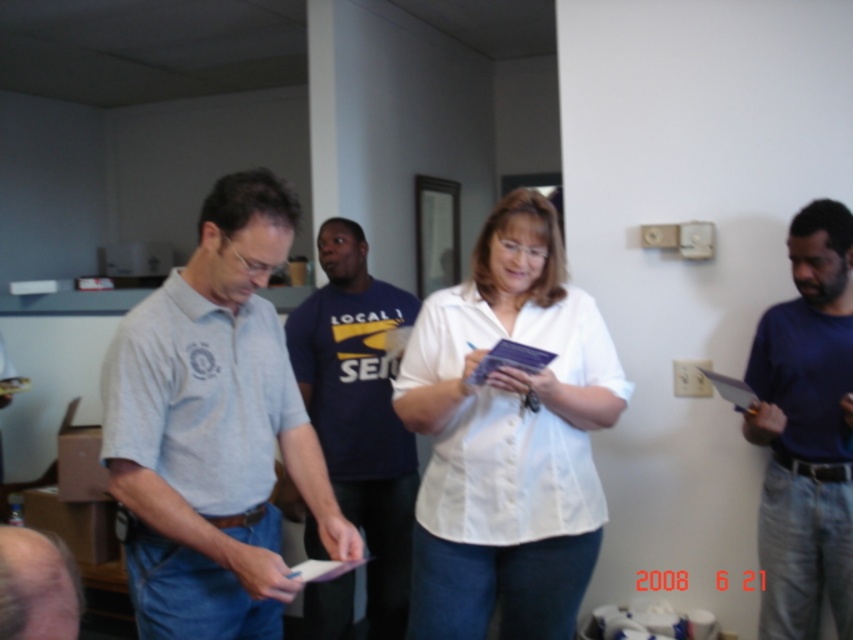
You are a photographer trying to capture a candid shot of the light gray cotton shirt at center. You notice a point at coordinates (213,428) in the image. Where is this point located?

The point at coordinates (213,428) is on the light gray cotton shirt at center.

In the scene shown: Looking at the scene, where is the white matte shirt at center in relation to the smooth skin head at lower left?

The white matte shirt at center is to the right of the smooth skin head at lower left.

In the image, there is a group of four people standing in a room with a light switch panel on the right wall. You notice a point at coordinates (508, 436). Which object or person is located at this coordinate?

The point at coordinates (508, 436) indicates the white matte shirt at center.